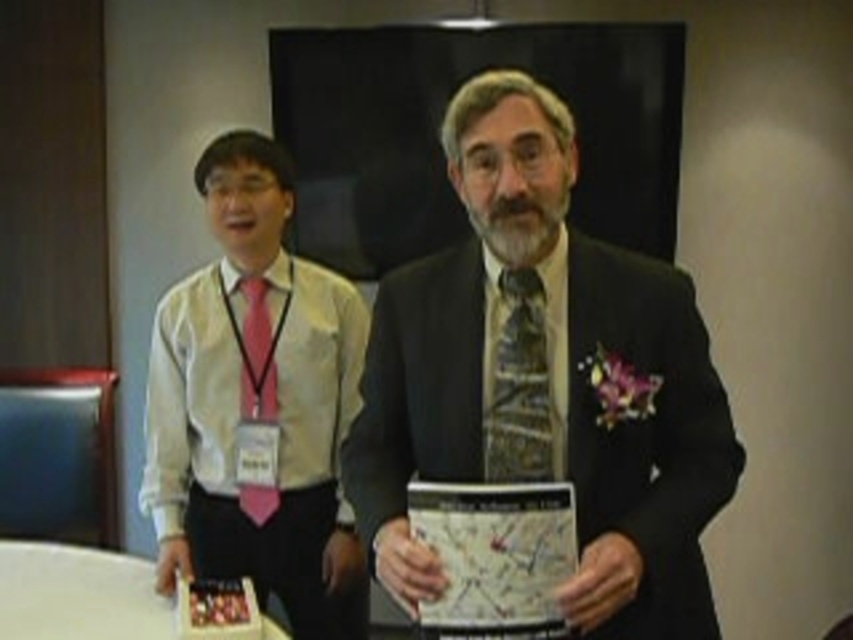
What do you see at coordinates (256, 403) in the screenshot?
I see `white shirt at left` at bounding box center [256, 403].

Who is shorter, white shirt at left or patterned silk tie at center?

patterned silk tie at center

Which is behind, point (251, 570) or point (527, 371)?

Point (251, 570)

Locate an element on the screen. This screenshot has height=640, width=853. white shirt at left is located at coordinates (256, 403).

Who is shorter, white glossy round table at lower left or pink satin tie at left?

With less height is white glossy round table at lower left.

Does point (169, 609) come in front of point (265, 493)?

Yes.

This screenshot has width=853, height=640. What do you see at coordinates (78, 593) in the screenshot?
I see `white glossy round table at lower left` at bounding box center [78, 593].

Image resolution: width=853 pixels, height=640 pixels. Find the location of `white glossy round table at lower left`. white glossy round table at lower left is located at coordinates (78, 593).

The image size is (853, 640). Describe the element at coordinates (78, 593) in the screenshot. I see `white glossy round table at lower left` at that location.

Is white glossy round table at lower left thinner than patterned silk tie at center?

In fact, white glossy round table at lower left might be wider than patterned silk tie at center.

Does point (155, 628) come behind point (495, 461)?

Yes, point (155, 628) is farther from viewer.

This screenshot has width=853, height=640. Identify the location of white glossy round table at lower left. (78, 593).